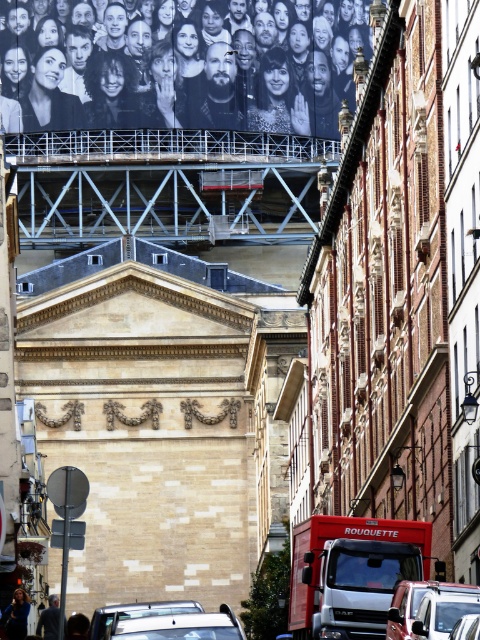
Is point (340, 584) positioned before point (192, 634)?

No.

At what (x,y) coordinates should I click in order to perform the action: click on red matte truck at center. Please return your answer as a coordinate pair (x, y). The image size is (480, 640). Looking at the image, I should click on (351, 570).

Is matte black billboard at upper center positioned in front of silver metallic car at center?

No, it is behind silver metallic car at center.

Does matte black billboard at upper center have a lesser height compared to silver metallic car at center?

No.

You are a GUI agent. You are given a task and a screenshot of the screen. Output one action in this format:
    pyautogui.click(x=<x>, y=<y>)
    Task: Click on the matte black billboard at upper center
    
    Given the screenshot: What is the action you would take?
    pyautogui.click(x=180, y=64)

The width and height of the screenshot is (480, 640). Identify the location of matte black billboard at upper center. (180, 64).

Locate an element on the screen. Image resolution: width=480 pixels, height=640 pixels. matte black billboard at upper center is located at coordinates (180, 64).

Between matte black billboard at upper center and white glossy car at center, which one is positioned lower?

white glossy car at center is below.

Who is more forward, (158, 109) or (463, 625)?

Point (463, 625) is in front.

I want to click on matte black billboard at upper center, so click(180, 64).